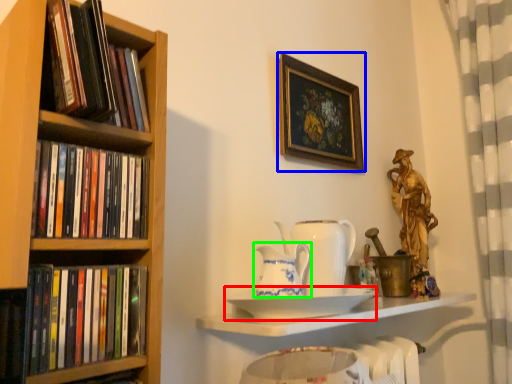
Question: Which is farther away from plate (highlighted by a red box)? picture frame (highlighted by a blue box) or tea pot (highlighted by a green box)?

Choices:
 (A) picture frame
 (B) tea pot

Answer: (A)